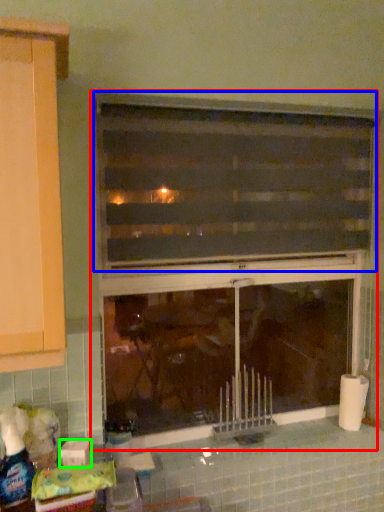
Question: Estimate the real-world distances between objects in this image. Which object is farther from window (highlighted by a red box), window (highlighted by a blue box) or toilet paper (highlighted by a green box)?

Choices:
 (A) window
 (B) toilet paper

Answer: (B)